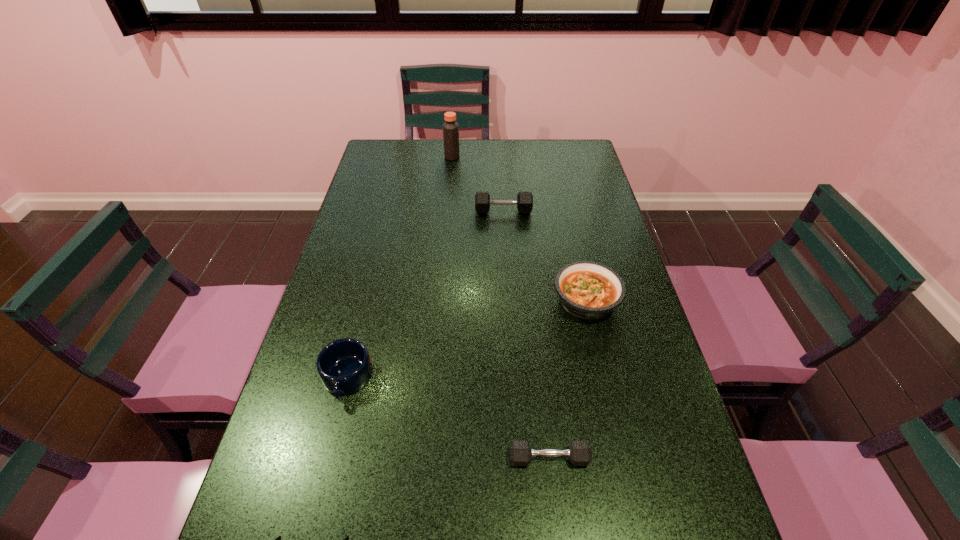
Image resolution: width=960 pixels, height=540 pixels. What are the coordinates of `vacant area that lies between the vinegar and the fifth farthest object` in the screenshot? It's located at (501, 307).

Locate an element on the screen. This screenshot has width=960, height=540. empty space that is in between the taller dumbbell and the third object from left to right is located at coordinates (478, 184).

The image size is (960, 540). Identify the location of free spot between the nearer dumbbell and the third farthest object. (567, 380).

Where is `vacant area that lies between the second farthest object and the nearer dumbbell`? vacant area that lies between the second farthest object and the nearer dumbbell is located at coordinates (526, 335).

The image size is (960, 540). I want to click on vacant space in between the third nearest object and the farthest object, so click(x=399, y=268).

Locate an element on the screen. The height and width of the screenshot is (540, 960). vacant area that lies between the taller dumbbell and the fifth farthest object is located at coordinates (526, 335).

Find the location of a particular element. The height and width of the screenshot is (540, 960). vacant area between the stew and the fifth farthest object is located at coordinates (567, 380).

Image resolution: width=960 pixels, height=540 pixels. In order to click on object that is the second closest to the spectacles in this screenshot , I will do `click(580, 454)`.

Find the location of a particular element. The height and width of the screenshot is (540, 960). object that is the fourth closest to the nearer dumbbell is located at coordinates (524, 201).